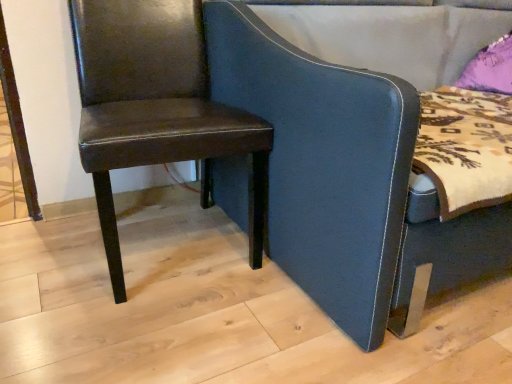
Where is `vacant space situated on the left part of matte brown leather chair at left, placed as the 1th chair when sorted from left to right`? The width and height of the screenshot is (512, 384). vacant space situated on the left part of matte brown leather chair at left, placed as the 1th chair when sorted from left to right is located at coordinates (45, 248).